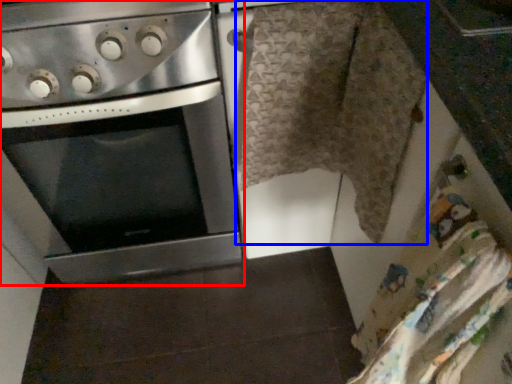
Question: Which object appears farthest to the camera in this image, oven (highlighted by a red box) or blanket (highlighted by a blue box)?

Choices:
 (A) oven
 (B) blanket

Answer: (A)